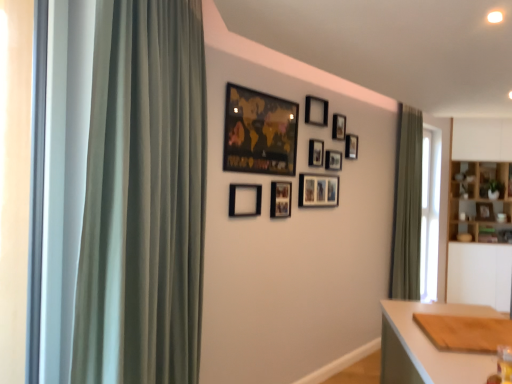
Question: Looking at the image, does wooden picture frame at center, which is the tenth picture frame in left-to-right order, seem bigger or smaller compared to green fabric curtain at left, marked as the first curtain in a left-to-right arrangement?

Choices:
 (A) small
 (B) big

Answer: (A)

Question: From the image's perspective, is wooden picture frame at center, placed as the 1th picture frame when sorted from right to left, above or below green fabric curtain at left, placed as the second curtain when sorted from back to front?

Choices:
 (A) above
 (B) below

Answer: (B)

Question: Based on their relative distances, which object is nearer to the black matte picture frame at upper center, marked as the sixth picture frame in a back-to-front arrangement?

Choices:
 (A) black matte picture frame at upper center, which ranks as the 9th picture frame in left-to-right order
 (B) matte black picture frame at upper center, placed as the 9th picture frame when sorted from right to left
 (C) green fabric curtain at right, the second curtain positioned from the front
 (D) black matte picture frame at center, the third picture frame when ordered from left to right
 (E) wooden cutting board at lower right

Answer: (A)

Question: Based on their relative distances, which object is nearer to the wooden cutting board at lower right?

Choices:
 (A) black matte picture frame at upper center, the 2th picture frame in the right-to-left sequence
 (B) black matte picture frame at upper center, the 4th picture frame when ordered from back to front
 (C) green fabric curtain at left, marked as the first curtain in a left-to-right arrangement
 (D) black matte picture frame at upper center, arranged as the 7th picture frame when viewed from the right
 (E) wooden picture frame at center, positioned as the first picture frame in back-to-front order

Answer: (C)